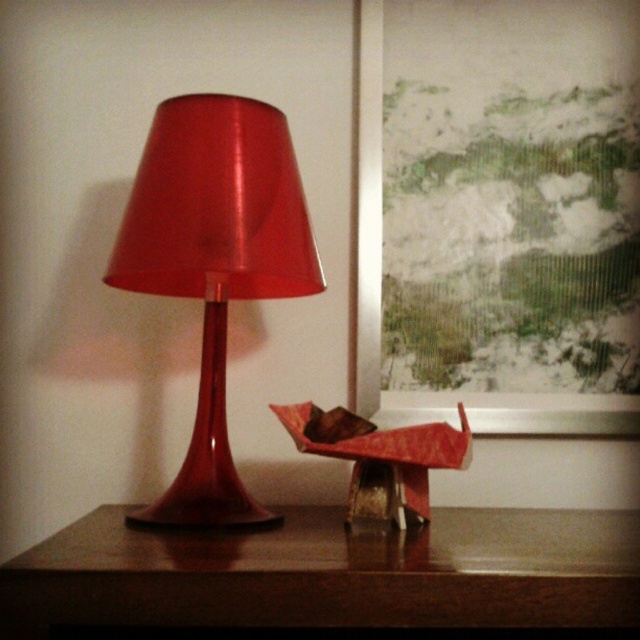
Question: Which point is closer to the camera taking this photo?

Choices:
 (A) (435, 552)
 (B) (202, 483)

Answer: (A)

Question: Does wooden table at center have a lesser width compared to shiny red table lamp at left?

Choices:
 (A) yes
 (B) no

Answer: (B)

Question: Can you confirm if wooden table at center is wider than shiny red table lamp at left?

Choices:
 (A) yes
 (B) no

Answer: (A)

Question: Does wooden table at center appear on the right side of shiny red table lamp at left?

Choices:
 (A) yes
 (B) no

Answer: (A)